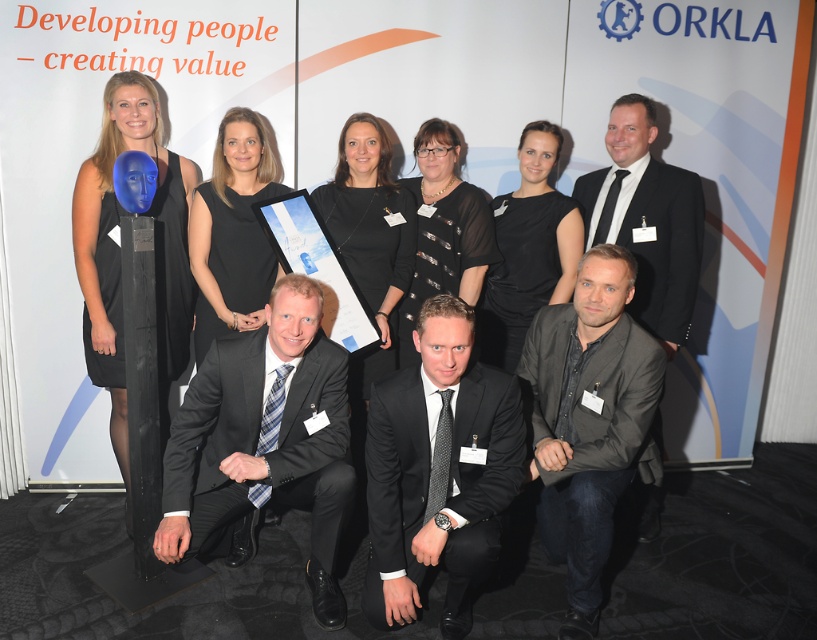
You are a photographer adjusting the camera settings to ensure all elements in the scene are in focus. The black satin suit at center and the blue matte mask at upper center are both important subjects. Which of these two objects should you prioritize focusing on first to ensure it remains sharp in the final image?

The black satin suit at center is taller than the blue matte mask at upper center, so you should prioritize focusing on the black satin suit at center first to ensure it remains sharp in the final image.

Please provide the 2D coordinates of the black satin suit at center in the image. The answer should be in the format of coordinates like 0.0 to 1.0 in x and y. The scene is a group photo with people in formal attire, and the object is a black satin suit located at the center of the image. The coordinates should be based on the image frame, where the bottom left corner is the origin point.

The 2D coordinates of the black satin suit at center are at point (438, 472).

You are organizing a photo shoot and need to ensure that the black suit at center and the black matte dress at upper center are positioned so that neither overlaps the other. Based on their widths, which one should be placed to the left to prevent overlap?

The black suit at center might be wider than black matte dress at upper center, so placing the black suit at center to the left would require more space. To prevent overlap, the narrower black matte dress at upper center should be placed to the left since it takes up less space.